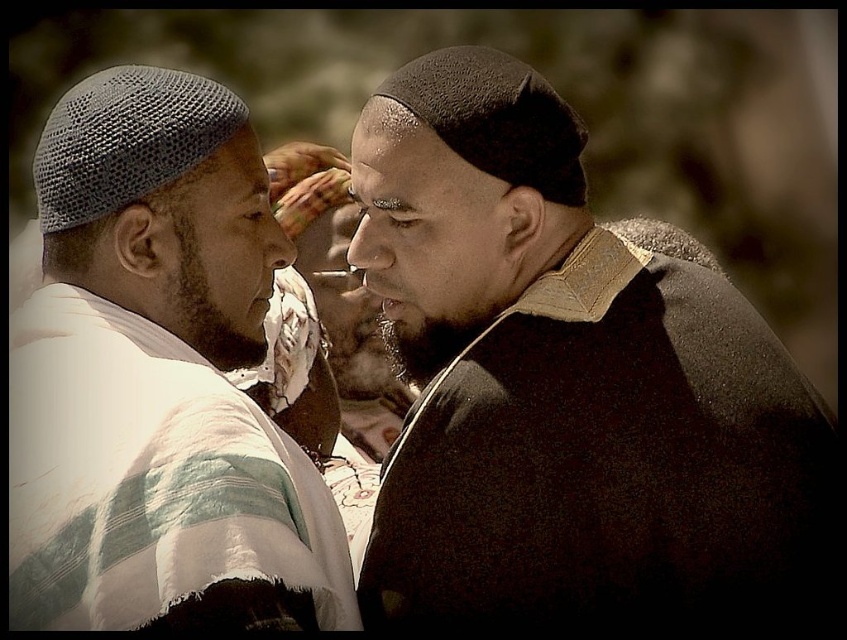
You are a photographer trying to capture a clear shot of the black fuzzy hat at upper center and the white striped fabric at left. Since you want both objects to appear equally prominent in the photo, which one should you zoom in on more?

The black fuzzy hat at upper center is much taller as white striped fabric at left, so you should zoom in more on the white striped fabric at left to balance their prominence in the photo.

You are a tailor who needs to determine which item requires more fabric to make between the black fuzzy hat at upper center and the smooth brown leather jacket at center. Based on the scene description, which item would need more fabric?

The black fuzzy hat at upper center requires more fabric since it is bigger than the smooth brown leather jacket at center.